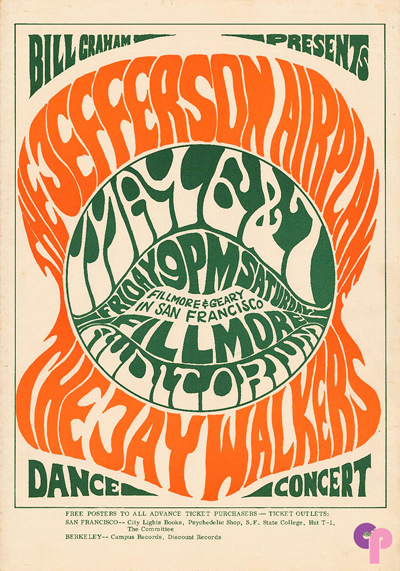
Locate an element on the screen. The image size is (400, 571). posters is located at coordinates (100, 513).